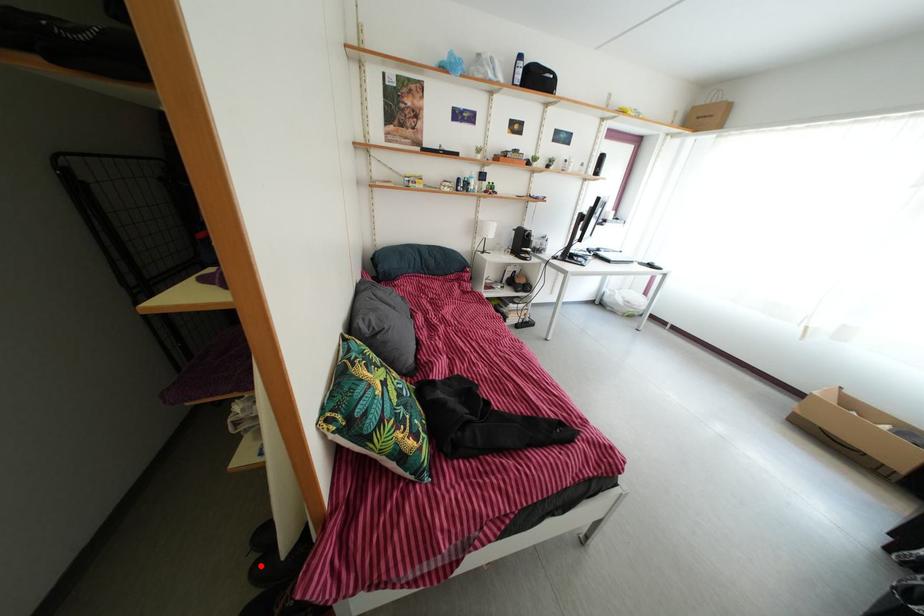
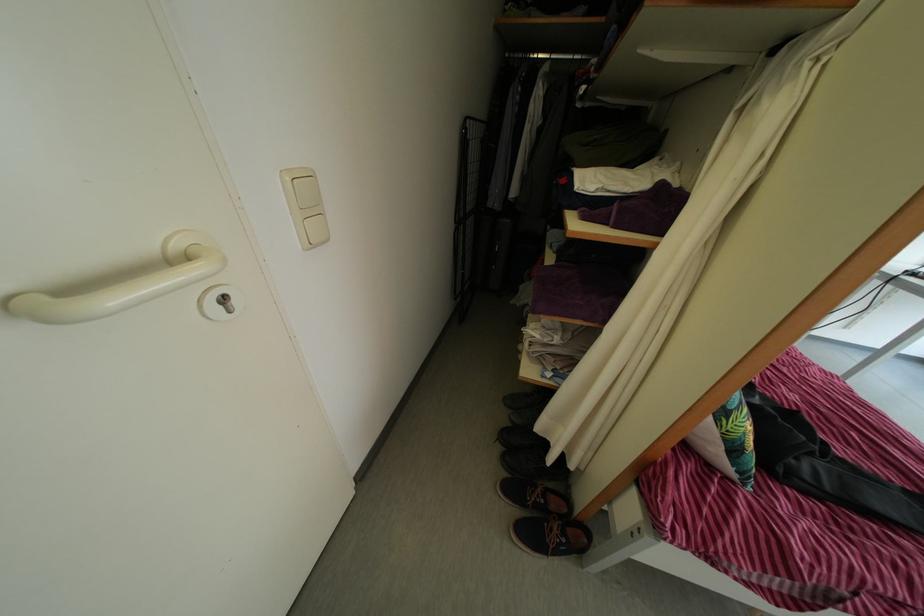
Where in the second image is the point corresponding to the highlighted location from the first image?

(505, 456)